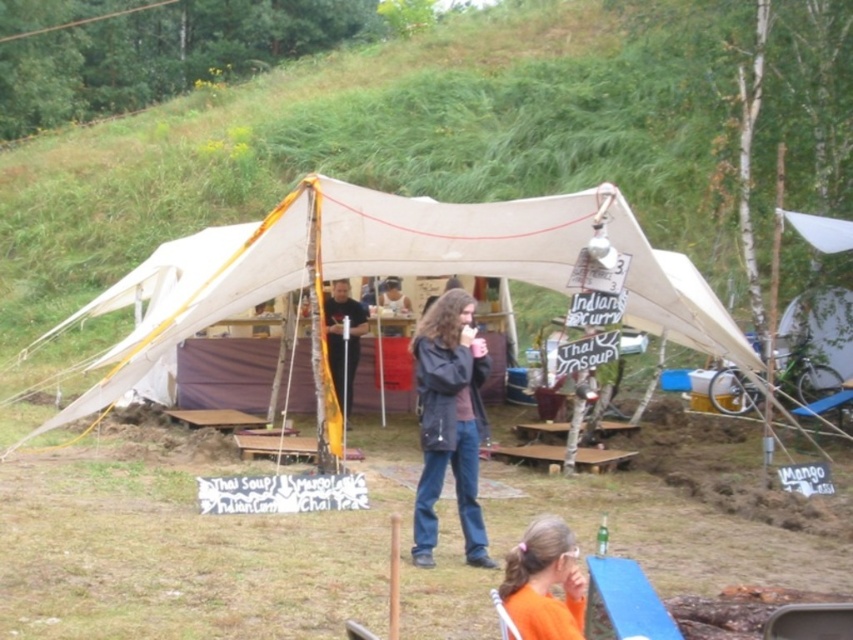
You are setting up a temporary food stall for a festival. You have a beige canvas tent at center and an orange fabric at lower center. Which object should you place first if you want to ensure the larger structure is positioned correctly before smaller items?

You should place the beige canvas tent at center first because its width is larger than the orange fabric at lower center, ensuring the larger structure is positioned correctly before smaller items.

You are setting up a food stall at the festival and need to place a beige canvas tent at center and an orange fabric at lower center. According to the scene, which object should be placed to the left of the other?

The beige canvas tent at center should be placed to the left of the orange fabric at lower center because the beige canvas tent at center is positioned on the left side of orange fabric at lower center.